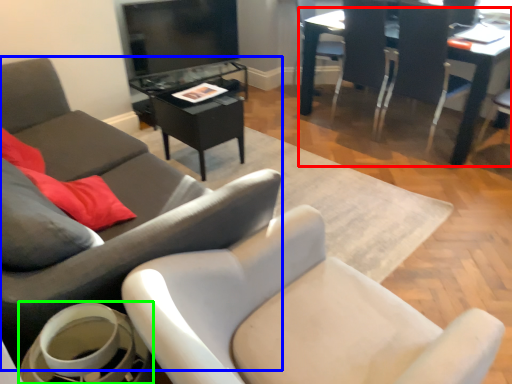
Question: Estimate the real-world distances between objects in this image. Which object is closer to table (highlighted by a red box), chair (highlighted by a blue box) or round table (highlighted by a green box)?

Choices:
 (A) chair
 (B) round table

Answer: (A)